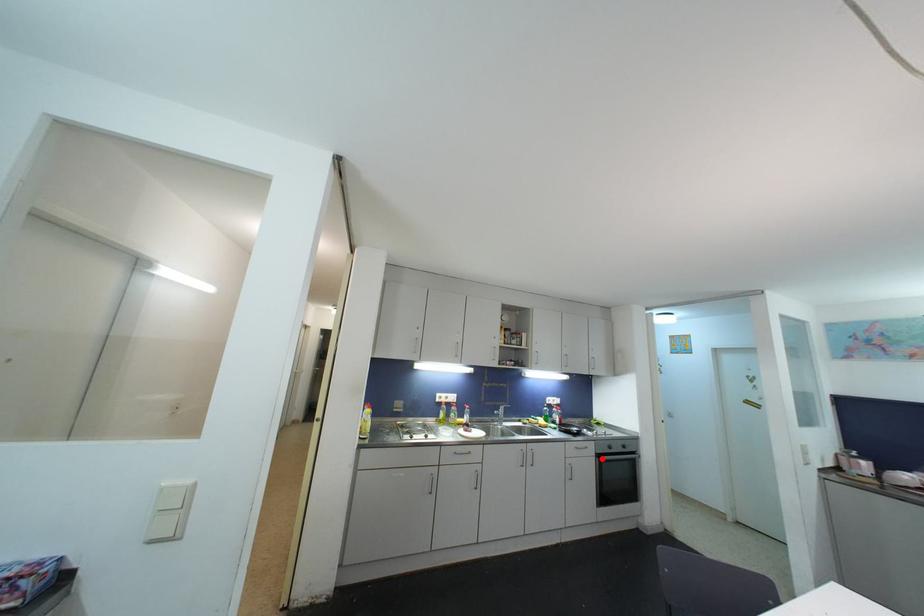
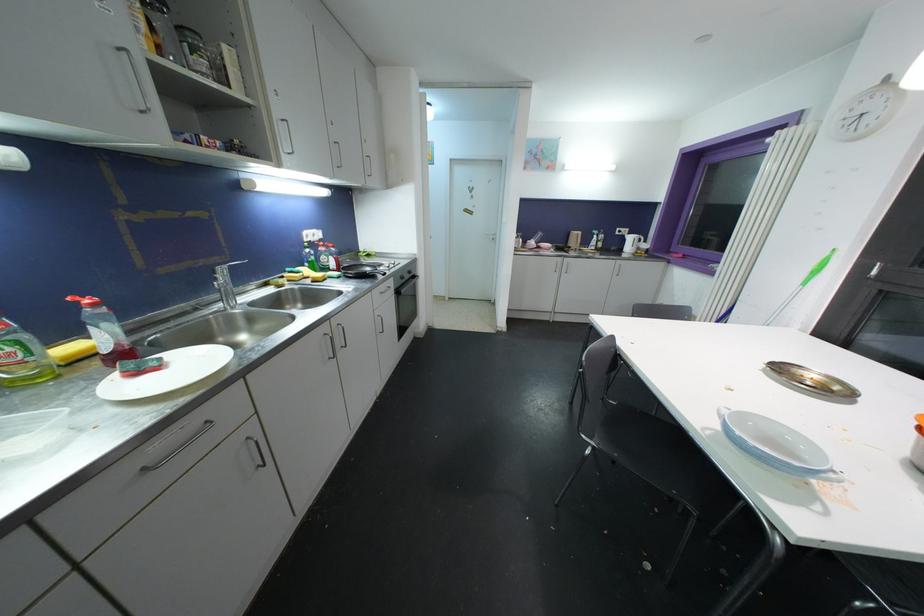
Find the pixel in the second image that matches the highlighted location in the first image.

(400, 294)